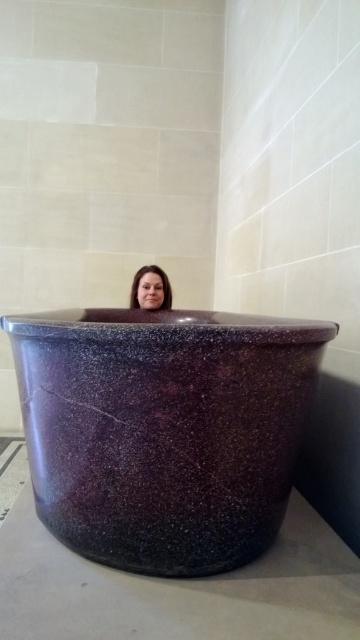
Between purple speckled stone at center and matte purple stone woman at center, which one has more height?

Standing taller between the two is purple speckled stone at center.

Can you confirm if purple speckled stone at center is positioned to the right of matte purple stone woman at center?

Correct, you'll find purple speckled stone at center to the right of matte purple stone woman at center.

Does point (23, 340) lie behind point (158, 294)?

No, (23, 340) is closer to viewer.

The image size is (360, 640). Find the location of `purple speckled stone at center`. purple speckled stone at center is located at coordinates (164, 429).